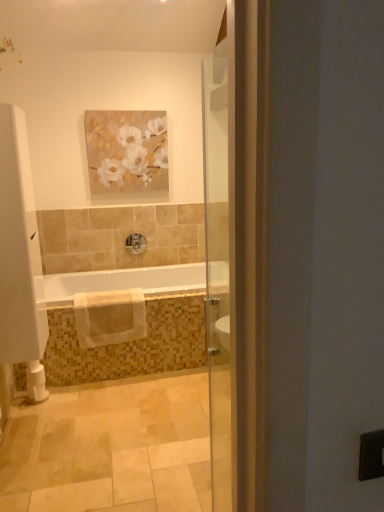
Question: Does beige cotton towel at lower center lie behind white towel at center?

Choices:
 (A) no
 (B) yes

Answer: (A)

Question: Is white towel at center located within beige cotton towel at lower center?

Choices:
 (A) yes
 (B) no

Answer: (B)

Question: Does beige cotton towel at lower center have a lesser width compared to white towel at center?

Choices:
 (A) yes
 (B) no

Answer: (A)

Question: Is beige cotton towel at lower center looking in the opposite direction of white towel at center?

Choices:
 (A) yes
 (B) no

Answer: (A)

Question: From the image's perspective, is beige cotton towel at lower center on top of white towel at center?

Choices:
 (A) yes
 (B) no

Answer: (B)

Question: Is beige cotton towel at lower center to the left of white towel at center from the viewer's perspective?

Choices:
 (A) no
 (B) yes

Answer: (B)

Question: From a real-world perspective, is matte floral painting at upper center over beige cotton towel at lower center?

Choices:
 (A) yes
 (B) no

Answer: (A)

Question: Can you confirm if matte floral painting at upper center is thinner than beige cotton towel at lower center?

Choices:
 (A) no
 (B) yes

Answer: (B)

Question: Does matte floral painting at upper center have a greater height compared to beige cotton towel at lower center?

Choices:
 (A) yes
 (B) no

Answer: (A)

Question: From the image's perspective, is matte floral painting at upper center located beneath beige cotton towel at lower center?

Choices:
 (A) yes
 (B) no

Answer: (B)

Question: From a real-world perspective, is matte floral painting at upper center beneath beige cotton towel at lower center?

Choices:
 (A) no
 (B) yes

Answer: (A)

Question: Can you confirm if matte floral painting at upper center is smaller than beige cotton towel at lower center?

Choices:
 (A) no
 (B) yes

Answer: (B)

Question: Are white towel at center and matte floral painting at upper center beside each other?

Choices:
 (A) no
 (B) yes

Answer: (A)